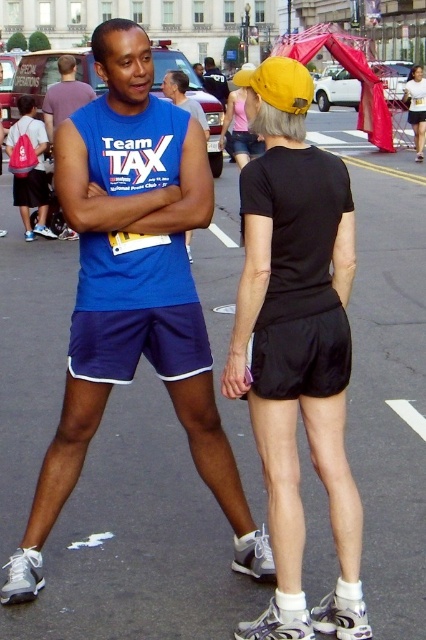
Who is more forward, (112, 170) or (414, 100)?

Point (112, 170)

Is blue sleeveless shirt at left wider than matte black shorts at center?

In fact, blue sleeveless shirt at left might be narrower than matte black shorts at center.

Is point (83, 452) closer to viewer compared to point (417, 148)?

Yes, it is in front of point (417, 148).

This screenshot has height=640, width=426. Identify the location of blue sleeveless shirt at left. (134, 291).

Is point (85, 268) positioned before point (247, 209)?

No, it is behind (247, 209).

What do you see at coordinates (134, 291) in the screenshot?
I see `blue sleeveless shirt at left` at bounding box center [134, 291].

Identify the location of blue sleeveless shirt at left. (134, 291).

Does blue sleeveless shirt at center have a lesser height compared to matte black shorts at center?

Indeed, blue sleeveless shirt at center has a lesser height compared to matte black shorts at center.

This screenshot has width=426, height=640. What do you see at coordinates (65, 96) in the screenshot?
I see `blue sleeveless shirt at center` at bounding box center [65, 96].

Between point (68, 93) and point (414, 84), which one is positioned in front?

Point (68, 93) is in front.

The width and height of the screenshot is (426, 640). I want to click on blue sleeveless shirt at center, so click(65, 96).